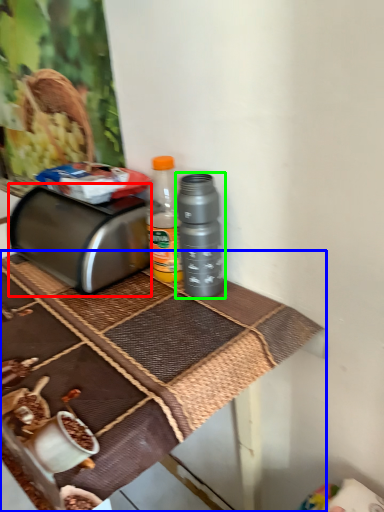
Question: Based on their relative distances, which object is nearer to toaster (highlighted by a red box)? Choose from table (highlighted by a blue box) and bottle (highlighted by a green box).

Choices:
 (A) table
 (B) bottle

Answer: (A)